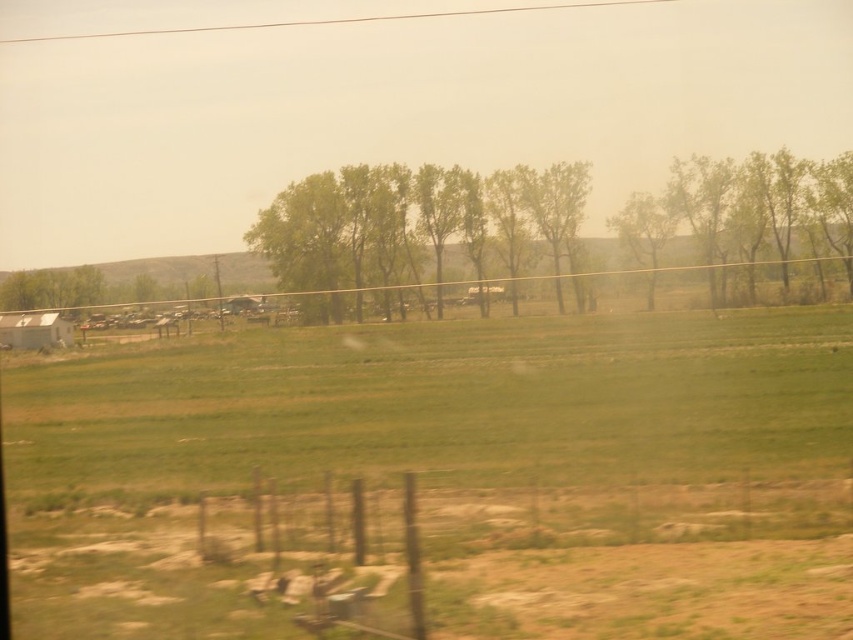
You are driving along a rural road and notice a rusty wire fence at lower center and green leafy trees at center in your view. Which object is positioned more to the left side of your view?

The rusty wire fence at lower center is positioned more to the left side of the view than the green leafy trees at center.

You are a hiker trying to estimate distances in the landscape. You see the rusty wire fence at lower center and the green leafy trees at center. How far apart are these two landmarks?

The rusty wire fence at lower center and the green leafy trees at center are 74.65 meters apart.

You are a hiker trying to estimate the tallest tree in the scene. You see two trees labeled as green leafy trees at center and green leafy tree at center. Which one is taller?

The green leafy trees at center is taller than the green leafy tree at center.